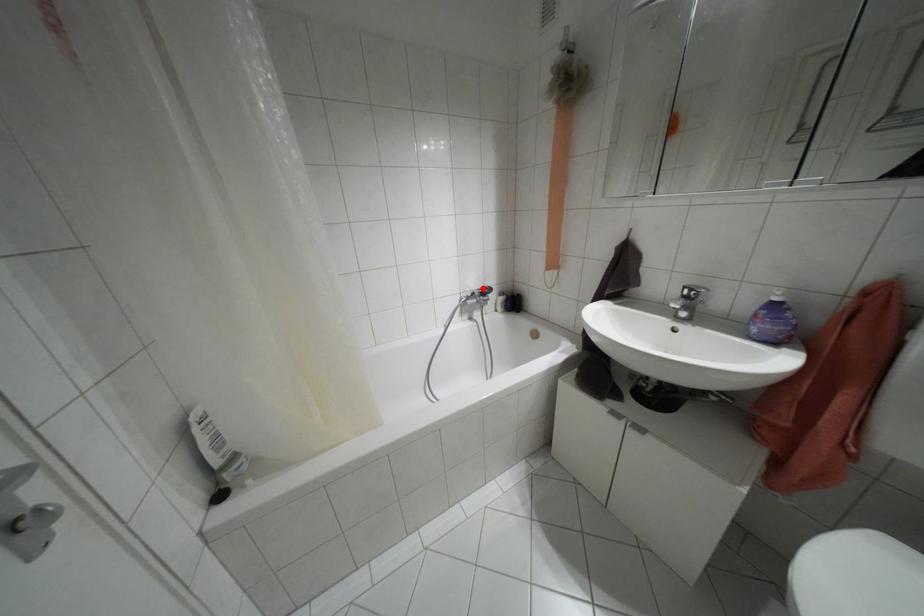
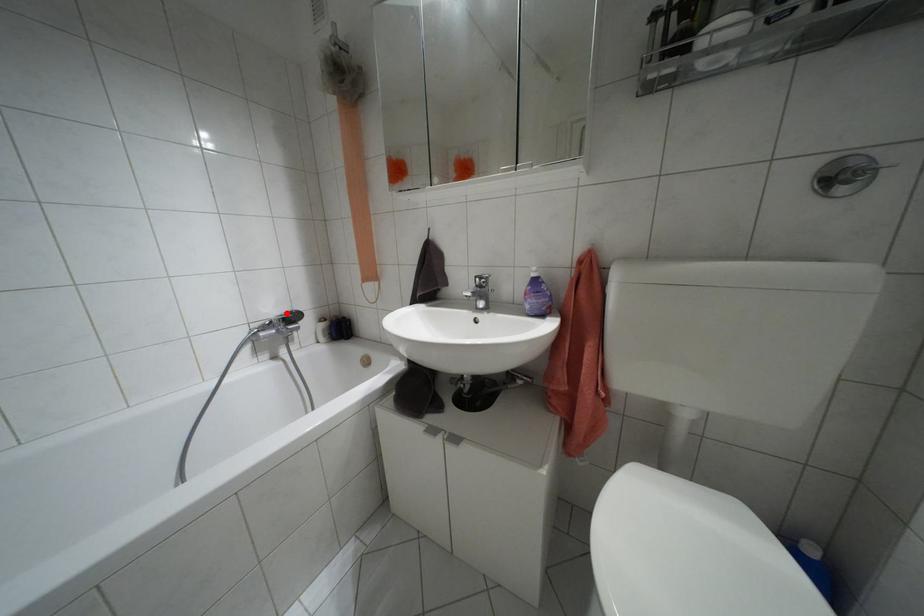
I am providing you with two images of the same scene from different viewpoints. A red point is marked on the first image and another point is marked on the second image. Is the red point in image1 aligned with the point shown in image2?

Yes